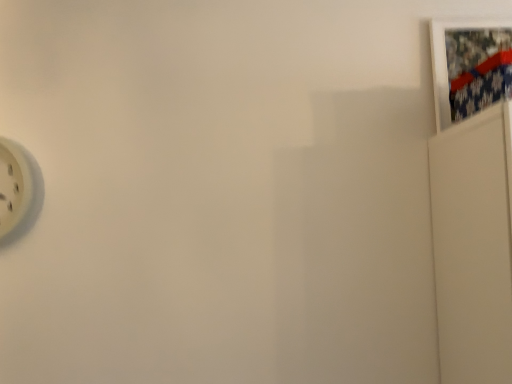
What is the approximate height of white plastic wall clock at left?

white plastic wall clock at left is 13.91 inches tall.

The image size is (512, 384). In order to click on white plastic wall clock at left in this screenshot , I will do `click(18, 190)`.

Describe the element at coordinates (18, 190) in the screenshot. The image size is (512, 384). I see `white plastic wall clock at left` at that location.

Find the location of a particular element. This screenshot has height=384, width=512. white matte picture frame at upper right is located at coordinates (446, 62).

Measure the distance between white matte picture frame at upper right and camera.

white matte picture frame at upper right is 4.10 feet from camera.

The width and height of the screenshot is (512, 384). Describe the element at coordinates (446, 62) in the screenshot. I see `white matte picture frame at upper right` at that location.

What is the approximate width of white matte picture frame at upper right?

white matte picture frame at upper right is 3.05 centimeters wide.

Find the location of a particular element. The height and width of the screenshot is (384, 512). white plastic wall clock at left is located at coordinates (18, 190).

Visually, is white plastic wall clock at left positioned to the left or to the right of white matte picture frame at upper right?

From the image, it's evident that white plastic wall clock at left is to the left of white matte picture frame at upper right.

Which object is further away from the camera taking this photo, white plastic wall clock at left or white matte picture frame at upper right?

white matte picture frame at upper right is further from the camera.

Is point (23, 162) closer to viewer compared to point (474, 27)?

Yes, point (23, 162) is in front of point (474, 27).

From the image's perspective, who appears lower, white plastic wall clock at left or white matte picture frame at upper right?

white plastic wall clock at left.

From a real-world perspective, relative to white matte picture frame at upper right, is white plastic wall clock at left vertically above or below?

Clearly, from a real-world perspective, white plastic wall clock at left is below white matte picture frame at upper right.

In the scene shown: Looking at their sizes, would you say white plastic wall clock at left is wider or thinner than white matte picture frame at upper right?

Clearly, white plastic wall clock at left has more width compared to white matte picture frame at upper right.

Can you confirm if white plastic wall clock at left is taller than white matte picture frame at upper right?

Incorrect, the height of white plastic wall clock at left is not larger of that of white matte picture frame at upper right.

Does white plastic wall clock at left have a smaller size compared to white matte picture frame at upper right?

No.

Would you say white matte picture frame at upper right is part of white plastic wall clock at left's contents?

No, white matte picture frame at upper right is not a part of white plastic wall clock at left.

Is white plastic wall clock at left placed right next to white matte picture frame at upper right?

No, white plastic wall clock at left is not next to white matte picture frame at upper right.

Is white plastic wall clock at left turned away from white matte picture frame at upper right?

white plastic wall clock at left does not have its back to white matte picture frame at upper right.

Can you tell me how much white plastic wall clock at left and white matte picture frame at upper right differ in facing direction?

The facing directions of white plastic wall clock at left and white matte picture frame at upper right are 0.833 degrees apart.

How much distance is there between white plastic wall clock at left and white matte picture frame at upper right?

A distance of 1.30 meters exists between white plastic wall clock at left and white matte picture frame at upper right.

Identify the location of wall clock that appears in front of the white matte picture frame at upper right. (x=18, y=190).

Does white matte picture frame at upper right appear on the right side of white plastic wall clock at left?

Correct, you'll find white matte picture frame at upper right to the right of white plastic wall clock at left.

Is white matte picture frame at upper right further to camera compared to white plastic wall clock at left?

Yes, white matte picture frame at upper right is further from the viewer.

Does point (437, 121) appear closer or farther from the camera than point (4, 231)?

Point (437, 121).

From the image's perspective, is white matte picture frame at upper right located beneath white plastic wall clock at left?

Incorrect, from the image's perspective, white matte picture frame at upper right is higher than white plastic wall clock at left.

From a real-world perspective, is white matte picture frame at upper right physically above white plastic wall clock at left?

Indeed, from a real-world perspective, white matte picture frame at upper right stands above white plastic wall clock at left.

Does white matte picture frame at upper right have a lesser width compared to white plastic wall clock at left?

Yes.

Who is shorter, white matte picture frame at upper right or white plastic wall clock at left?

white plastic wall clock at left is shorter.

Who is smaller, white matte picture frame at upper right or white plastic wall clock at left?

With smaller size is white matte picture frame at upper right.

Is white matte picture frame at upper right not within white plastic wall clock at left?

Indeed, white matte picture frame at upper right is completely outside white plastic wall clock at left.

Can you see white matte picture frame at upper right touching white plastic wall clock at left?

No, white matte picture frame at upper right is not next to white plastic wall clock at left.

Looking at this image, is white matte picture frame at upper right oriented towards white plastic wall clock at left?

No, white matte picture frame at upper right is not oriented towards white plastic wall clock at left.

How different are the orientations of white matte picture frame at upper right and white plastic wall clock at left in degrees?

0.833 degrees.

You are a GUI agent. You are given a task and a screenshot of the screen. Output one action in this format:
    pyautogui.click(x=<x>, y=<y>)
    Task: Click on the picture frame lying on the right of white plastic wall clock at left
    
    Given the screenshot: What is the action you would take?
    pyautogui.click(x=446, y=62)

The height and width of the screenshot is (384, 512). Find the location of `wall clock below the white matte picture frame at upper right (from a real-world perspective)`. wall clock below the white matte picture frame at upper right (from a real-world perspective) is located at coordinates (18, 190).

Where is `picture frame positioned vertically above the white plastic wall clock at left (from a real-world perspective)`? The image size is (512, 384). picture frame positioned vertically above the white plastic wall clock at left (from a real-world perspective) is located at coordinates (446, 62).